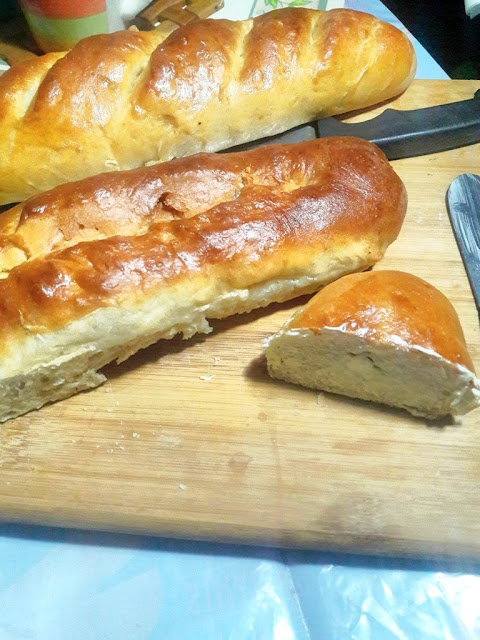
Where is `empty space on chopping board`? empty space on chopping board is located at coordinates (232, 461).